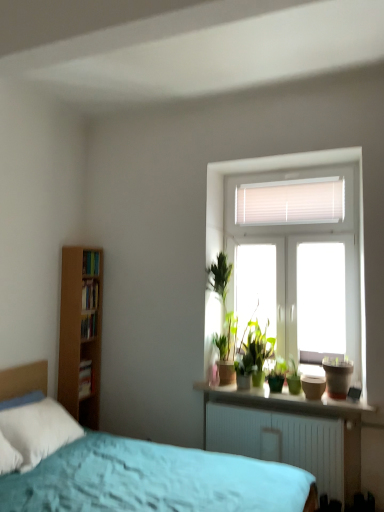
Question: Considering the relative positions of smooth concrete window sill at center and hardcover book at left, which appears as the second book when ordered from the bottom, in the image provided, is smooth concrete window sill at center behind hardcover book at left, which appears as the second book when ordered from the bottom,?

Choices:
 (A) yes
 (B) no

Answer: (B)

Question: Is smooth concrete window sill at center thinner than hardcover book at left, the 3th book positioned from the top?

Choices:
 (A) no
 (B) yes

Answer: (A)

Question: Is smooth concrete window sill at center oriented away from hardcover book at left, which appears as the second book when ordered from the bottom?

Choices:
 (A) yes
 (B) no

Answer: (B)

Question: Does smooth concrete window sill at center lie in front of hardcover book at left, the 3th book positioned from the top?

Choices:
 (A) no
 (B) yes

Answer: (B)

Question: Is smooth concrete window sill at center facing towards hardcover book at left, the 3th book positioned from the top?

Choices:
 (A) no
 (B) yes

Answer: (A)

Question: Is smooth concrete window sill at center in contact with hardcover book at left, the 3th book positioned from the top?

Choices:
 (A) no
 (B) yes

Answer: (A)

Question: Is matte brown flowerpot at right at the left side of green matte houseplant at center?

Choices:
 (A) no
 (B) yes

Answer: (A)

Question: Can we say matte brown flowerpot at right lies outside green matte houseplant at center?

Choices:
 (A) yes
 (B) no

Answer: (A)

Question: Is matte brown flowerpot at right with green matte houseplant at center?

Choices:
 (A) yes
 (B) no

Answer: (B)

Question: Can you confirm if matte brown flowerpot at right is wider than green matte houseplant at center?

Choices:
 (A) no
 (B) yes

Answer: (B)

Question: Is matte brown flowerpot at right positioned before green matte houseplant at center?

Choices:
 (A) no
 (B) yes

Answer: (B)

Question: Would you consider matte brown flowerpot at right to be distant from green matte houseplant at center?

Choices:
 (A) no
 (B) yes

Answer: (A)

Question: From a real-world perspective, is matte brown flowerpot at right physically below smooth concrete window sill at center?

Choices:
 (A) no
 (B) yes

Answer: (A)